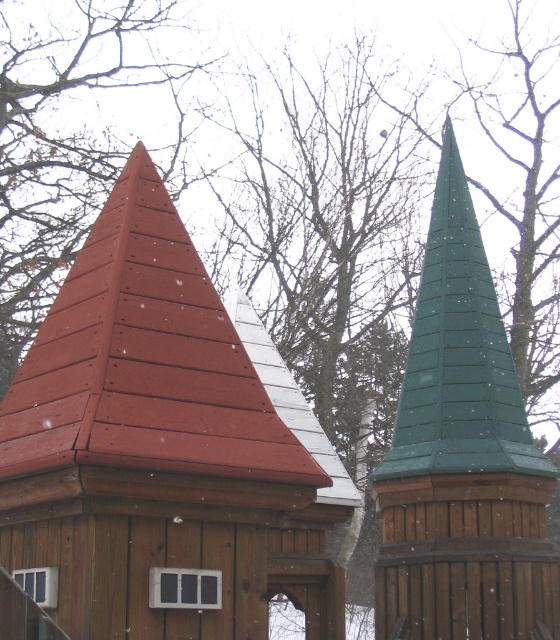
Between matte red shingles at upper left and green wooden spire at right, which one has more height?

green wooden spire at right is taller.

Is matte red shingles at upper left to the left of green wooden spire at right from the viewer's perspective?

Indeed, matte red shingles at upper left is positioned on the left side of green wooden spire at right.

Does point (249, 412) come behind point (445, 252)?

No, (249, 412) is in front of (445, 252).

Find the location of a particular element. The height and width of the screenshot is (640, 560). matte red shingles at upper left is located at coordinates (162, 449).